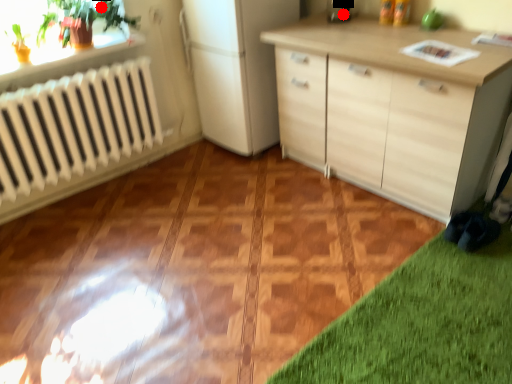
Question: Two points are circled on the image, labeled by A and B beside each circle. Which point is further to the camera?

Choices:
 (A) A is further
 (B) B is further

Answer: (B)